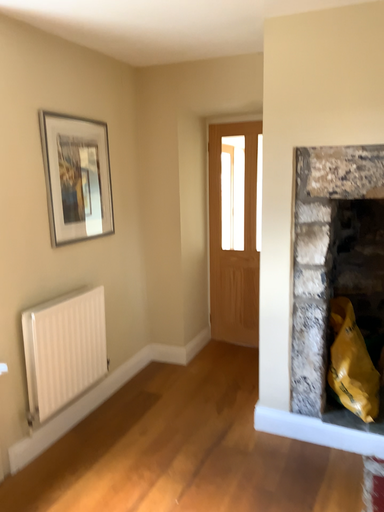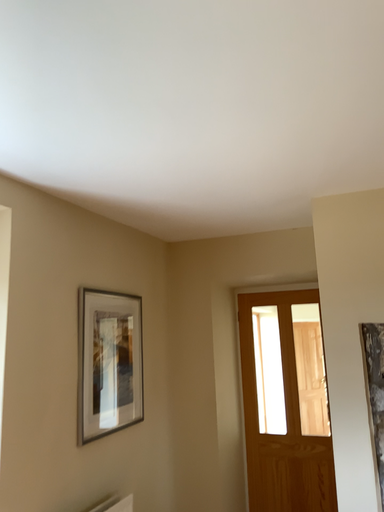
Question: Which way did the camera rotate in the video?

Choices:
 (A) rotated downward
 (B) rotated upward

Answer: (B)